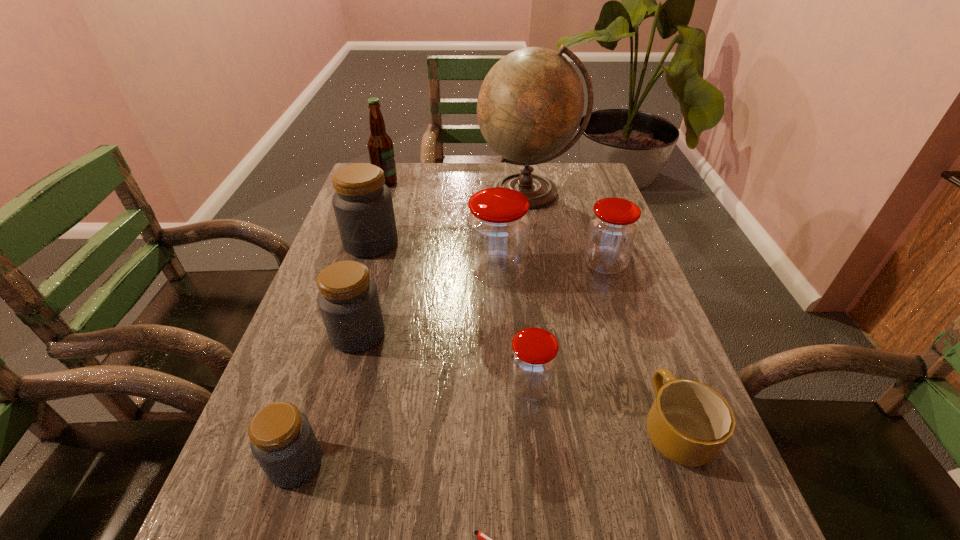
What are the coordinates of `free space that satisfies the following two spatial constraints: 1. on the surface of the rightmost red jar near the warning symbol; 2. on the right side of the farthest gray jar` in the screenshot? It's located at (365, 264).

I want to click on vacant space that satisfies the following two spatial constraints: 1. on the back side of the nearest red jar; 2. on the label of the second tallest object, so click(x=510, y=183).